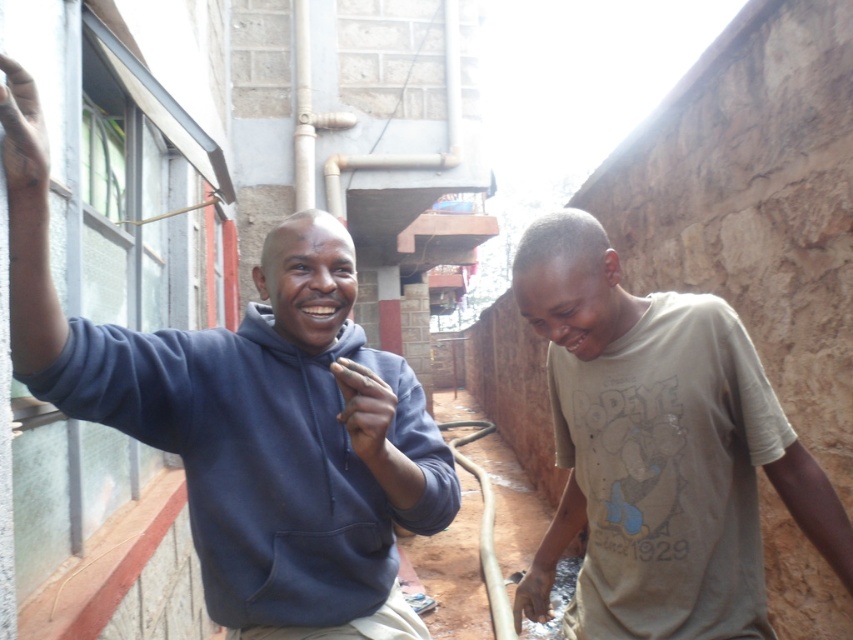
Question: Which of the following is the closest to the observer?

Choices:
 (A) (453, 504)
 (B) (779, 432)

Answer: (A)

Question: Is dark blue hoodie at left positioned in front of light brown cotton shirt at lower right?

Choices:
 (A) no
 (B) yes

Answer: (B)

Question: Which object is farther from the camera taking this photo?

Choices:
 (A) dark blue hoodie at left
 (B) light brown cotton shirt at lower right

Answer: (B)

Question: Does dark blue hoodie at left appear on the left side of light brown cotton shirt at lower right?

Choices:
 (A) no
 (B) yes

Answer: (B)

Question: Which object is closer to the camera taking this photo?

Choices:
 (A) light brown cotton shirt at lower right
 (B) dark blue hoodie at left

Answer: (B)

Question: Does dark blue hoodie at left appear under light brown cotton shirt at lower right?

Choices:
 (A) no
 (B) yes

Answer: (A)